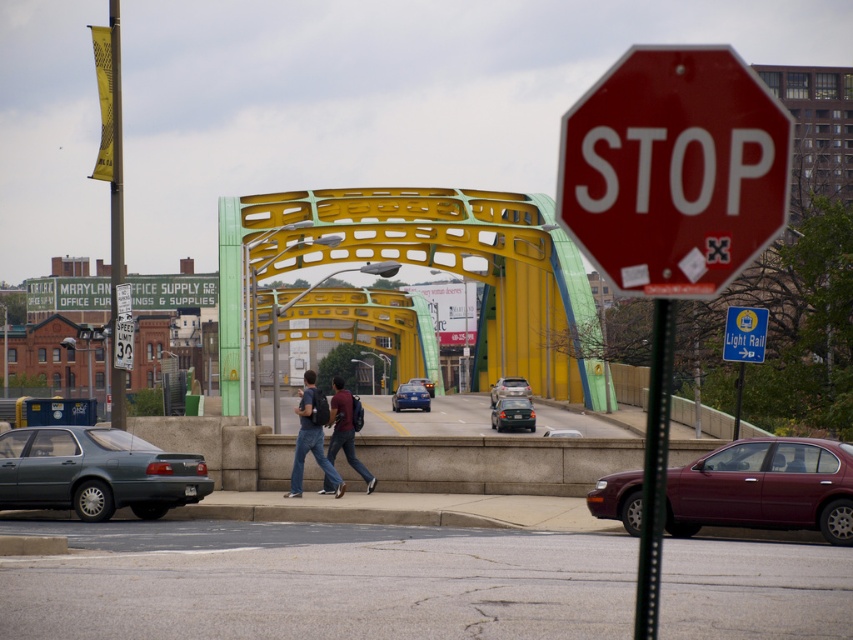
You are a delivery driver approaching the intersection and need to know which object is narrower between the red matte stop sign at upper right and the metallic pole at right. Which one is narrower?

The red matte stop sign at upper right is thinner than the metallic pole at right, so the red matte stop sign at upper right is narrower.

You are standing at the intersection near the STOP sign and need to locate two points marked on the bridge structure. The first point is at coordinates point [659,525] and the second is at point [426,387]. Which point is closer to your current position?

Point [659,525] is closer to the camera than point [426,387], so the first point is closer to your current position.